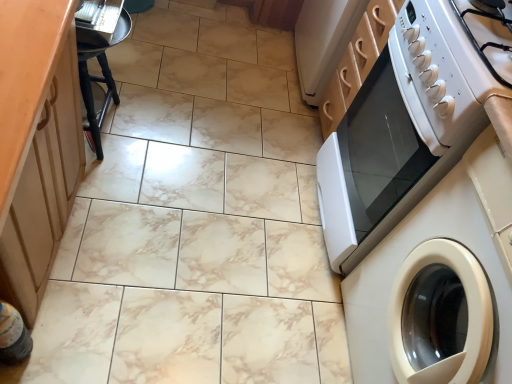
This screenshot has width=512, height=384. Describe the element at coordinates (13, 336) in the screenshot. I see `translucent plastic bottle at lower left` at that location.

Measure the distance between black wood stool at left and camera.

black wood stool at left is 3.86 feet from camera.

The width and height of the screenshot is (512, 384). Find the location of `white glossy washing machine at right`. white glossy washing machine at right is located at coordinates (437, 238).

I want to click on translucent plastic bottle at lower left, so click(13, 336).

From a real-world perspective, who is located lower, translucent plastic bottle at lower left or wooden cabinet at left?

In real-world perspective, translucent plastic bottle at lower left is lower.

In the scene shown: Is translucent plastic bottle at lower left turned away from wooden cabinet at left?

Yes, wooden cabinet at left is at the back of translucent plastic bottle at lower left.

Is translucent plastic bottle at lower left at the left side of wooden cabinet at left?

In fact, translucent plastic bottle at lower left is to the right of wooden cabinet at left.

Considering the relative sizes of translucent plastic bottle at lower left and wooden cabinet at left in the image provided, is translucent plastic bottle at lower left smaller than wooden cabinet at left?

Indeed, translucent plastic bottle at lower left has a smaller size compared to wooden cabinet at left.

Is wooden cabinet at left not near translucent plastic bottle at lower left?

wooden cabinet at left is actually quite close to translucent plastic bottle at lower left.

From the image's perspective, who appears lower, wooden cabinet at left or translucent plastic bottle at lower left?

translucent plastic bottle at lower left.

Is wooden cabinet at left positioned before translucent plastic bottle at lower left?

Yes, it is in front of translucent plastic bottle at lower left.

Does wooden cabinet at left turn towards translucent plastic bottle at lower left?

Yes, wooden cabinet at left is turned towards translucent plastic bottle at lower left.

Which is behind, point (493, 82) or point (34, 174)?

Positioned behind is point (34, 174).

Can you see white glossy gas stove at upper right touching wooden cabinet at left?

white glossy gas stove at upper right and wooden cabinet at left are clearly separated.

Identify the location of cabinetry lying on the left of white glossy gas stove at upper right. This screenshot has height=384, width=512. (36, 143).

Who is more distant, white glossy gas stove at upper right or white glossy washing machine at right?

white glossy gas stove at upper right is further away from the camera.

Is white glossy gas stove at upper right looking in the opposite direction of white glossy washing machine at right?

That's not correct — white glossy gas stove at upper right is not looking away from white glossy washing machine at right.

Is point (430, 124) in front of point (470, 218)?

That is False.

Can you tell me how much white glossy gas stove at upper right and white glossy washing machine at right differ in facing direction?

The angle between the facing direction of white glossy gas stove at upper right and the facing direction of white glossy washing machine at right is 0.301 degrees.

Is wooden cabinet at left behind white glossy gas stove at upper right?

No, wooden cabinet at left is in front of white glossy gas stove at upper right.

Could you tell me if wooden cabinet at left is turned towards white glossy gas stove at upper right?

Yes, wooden cabinet at left is oriented towards white glossy gas stove at upper right.

Considering the sizes of wooden cabinet at left and white glossy gas stove at upper right in the image, is wooden cabinet at left wider or thinner than white glossy gas stove at upper right?

Clearly, wooden cabinet at left has less width compared to white glossy gas stove at upper right.

Would you consider wooden cabinet at left to be distant from white glossy gas stove at upper right?

No, wooden cabinet at left is in close proximity to white glossy gas stove at upper right.

Which object is thinner, white glossy oven at right or translucent plastic bottle at lower left?

With smaller width is translucent plastic bottle at lower left.

Considering the positions of objects white glossy oven at right and translucent plastic bottle at lower left in the image provided, who is behind, white glossy oven at right or translucent plastic bottle at lower left?

white glossy oven at right is further away from the camera.

From the image's perspective, is white glossy oven at right on translucent plastic bottle at lower left?

Yes, from the image's perspective, white glossy oven at right is on top of translucent plastic bottle at lower left.

Considering the positions of objects white glossy oven at right and translucent plastic bottle at lower left in the image provided, who is more to the right, white glossy oven at right or translucent plastic bottle at lower left?

white glossy oven at right is more to the right.

Is white glossy washing machine at right bigger than wooden cabinet at left?

No.

From a real-world perspective, which object stands above the other?

In real-world perspective, white glossy washing machine at right is above.

Is white glossy washing machine at right positioned before wooden cabinet at left?

That is False.

Is white glossy washing machine at right facing towards wooden cabinet at left?

Yes.

Where is `bottle on the right side of wooden cabinet at left`? bottle on the right side of wooden cabinet at left is located at coordinates (13, 336).

The width and height of the screenshot is (512, 384). In order to click on bottle lying below the wooden cabinet at left (from the image's perspective) in this screenshot , I will do `click(13, 336)`.

From the image, which object appears to be nearer to white glossy oven at right, white glossy washing machine at right or wooden cabinet at left?

white glossy washing machine at right lies closer to white glossy oven at right than the other object.

Which object lies nearer to the anchor point wooden cabinet at left, black wood stool at left or white glossy gas stove at upper right?

The object closer to wooden cabinet at left is black wood stool at left.

When comparing their distances from translucent plastic bottle at lower left, does wooden cabinet at left or black wood stool at left seem further?

The object further to translucent plastic bottle at lower left is black wood stool at left.

From the image, which object appears to be nearer to translucent plastic bottle at lower left, white glossy oven at right or black wood stool at left?

black wood stool at left is closer to translucent plastic bottle at lower left.

Based on their spatial positions, is translucent plastic bottle at lower left or white glossy washing machine at right further from wooden cabinet at left?

Among the two, white glossy washing machine at right is located further to wooden cabinet at left.

Considering their positions, is white glossy washing machine at right positioned closer to white glossy oven at right than white glossy gas stove at upper right?

white glossy gas stove at upper right.

When comparing their distances from translucent plastic bottle at lower left, does white glossy gas stove at upper right or white glossy washing machine at right seem further?

The object further to translucent plastic bottle at lower left is white glossy gas stove at upper right.

Which object lies nearer to the anchor point white glossy washing machine at right, white glossy oven at right or wooden cabinet at left?

white glossy oven at right lies closer to white glossy washing machine at right than the other object.

At what (x,y) coordinates should I click in order to perform the action: click on home appliance between wooden cabinet at left and white glossy washing machine at right. Please return your answer as a coordinate pair (x, y). Looking at the image, I should click on (412, 120).

Where is `bottle situated between wooden cabinet at left and white glossy washing machine at right from left to right`? This screenshot has width=512, height=384. bottle situated between wooden cabinet at left and white glossy washing machine at right from left to right is located at coordinates (13, 336).

Where is `home appliance between white glossy gas stove at upper right and white glossy washing machine at right in the vertical direction`? home appliance between white glossy gas stove at upper right and white glossy washing machine at right in the vertical direction is located at coordinates (412, 120).

At what (x,y) coordinates should I click in order to perform the action: click on bottle between wooden cabinet at left and black wood stool at left in the front-back direction. Please return your answer as a coordinate pair (x, y). Looking at the image, I should click on (13, 336).